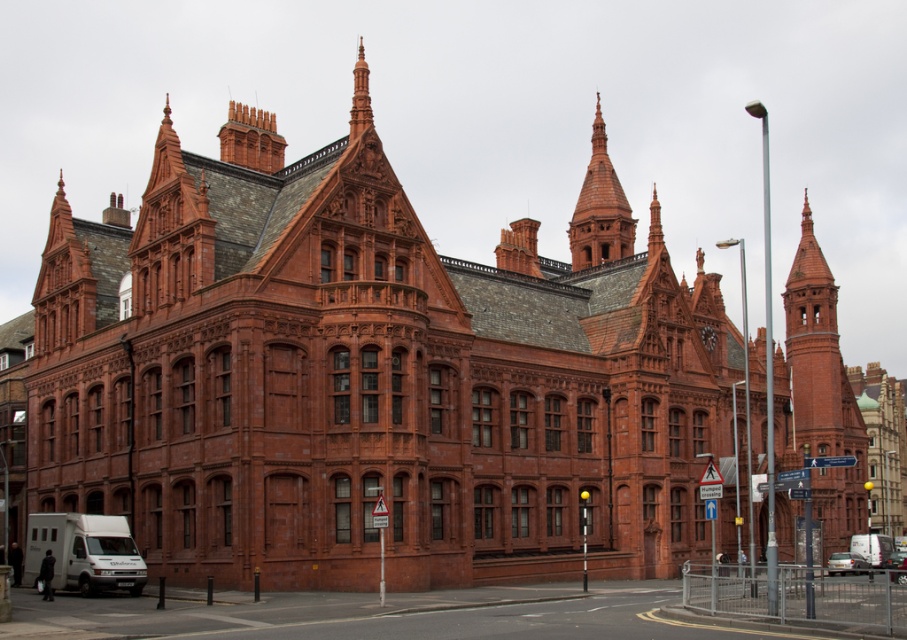
From the picture: You are a drone operator tasked with capturing aerial footage of the historic building. Your drone is currently hovering near the smooth terracotta spire at upper center. You need to fly it to the silver metallic car at lower right. Considering the drone has a maximum flight range of 50 meters, will it be able to reach the car without needing to recharge?

The distance between the smooth terracotta spire at upper center and the silver metallic car at lower right is 56.07 meters. Since the drone can only fly up to 50 meters before needing a recharge, it will not be able to reach the car without recharging.

You are a photographer planning to take a photo of the grand historic building. You want to ensure that both the smooth terracotta spire at upper center and the silver metallic car at lower right are clearly visible in the frame. Considering their sizes, which object should you prioritize positioning closer to the camera to maintain their relative sizes as seen in the original scene?

The smooth terracotta spire at upper center is bigger than the silver metallic car at lower right. To maintain their relative sizes, you should prioritize positioning the silver metallic car at lower right closer to the camera since it is smaller and needs to appear proportionally smaller in the frame compared to the spire.